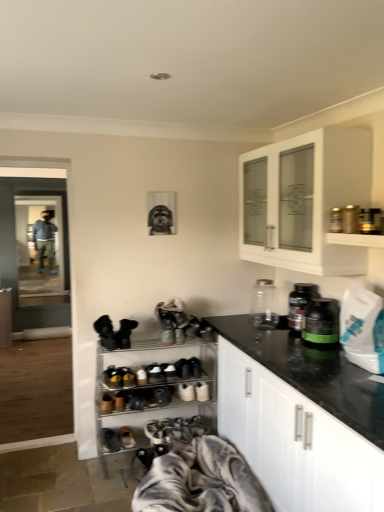
Question: Can you confirm if white glossy cabinet at upper right, which is the second cabinetry in right-to-left order, is bigger than brown suede shoe at lower center, positioned as the 3th footwear in top-to-bottom order?

Choices:
 (A) yes
 (B) no

Answer: (A)

Question: From the image's perspective, is white glossy cabinet at upper right, the first cabinetry in the top-to-bottom sequence, beneath brown suede shoe at lower center, positioned as the 3th footwear in top-to-bottom order?

Choices:
 (A) no
 (B) yes

Answer: (A)

Question: Considering the relative sizes of white glossy cabinet at upper right, which ranks as the second cabinetry in back-to-front order, and brown suede shoe at lower center, positioned as the 3th footwear in top-to-bottom order, in the image provided, is white glossy cabinet at upper right, which ranks as the second cabinetry in back-to-front order, shorter than brown suede shoe at lower center, positioned as the 3th footwear in top-to-bottom order,?

Choices:
 (A) no
 (B) yes

Answer: (A)

Question: Is brown suede shoe at lower center, positioned as the 3th footwear in top-to-bottom order, surrounded by white glossy cabinet at upper right, which is the second cabinetry from front to back?

Choices:
 (A) no
 (B) yes

Answer: (A)

Question: Is white glossy cabinet at upper right, the second cabinetry viewed from the left, with brown suede shoe at lower center, positioned as the 3th footwear in top-to-bottom order?

Choices:
 (A) yes
 (B) no

Answer: (B)

Question: Is white suede sneakers at center, which is the 2th footwear in top-to-bottom order, taller or shorter than white matte cabinet at lower right, acting as the first cabinetry starting from the right?

Choices:
 (A) tall
 (B) short

Answer: (B)

Question: Considering the positions of white suede sneakers at center, which is the 2th footwear in top-to-bottom order, and white matte cabinet at lower right, acting as the first cabinetry starting from the right, in the image, is white suede sneakers at center, which is the 2th footwear in top-to-bottom order, wider or thinner than white matte cabinet at lower right, acting as the first cabinetry starting from the right,?

Choices:
 (A) thin
 (B) wide

Answer: (A)

Question: Is point [x=178, y=394] positioned closer to the camera than point [x=263, y=480]?

Choices:
 (A) closer
 (B) farther

Answer: (B)

Question: In the image, is white suede sneakers at center, the fourth footwear when ordered from bottom to top, on the left side or the right side of white matte cabinet at lower right, placed as the third cabinetry when sorted from back to front?

Choices:
 (A) right
 (B) left

Answer: (B)

Question: From the image's perspective, relative to white matte cabinet at lower right, placed as the 3th cabinetry when sorted from left to right, is black matte shoe at center, which is the 4th shoe from left to right, above or below?

Choices:
 (A) above
 (B) below

Answer: (A)

Question: Considering their positions, is black matte shoe at center, which is the 4th shoe from left to right, located in front of or behind white matte cabinet at lower right, placed as the 3th cabinetry when sorted from left to right?

Choices:
 (A) behind
 (B) front

Answer: (A)

Question: In terms of width, does black matte shoe at center, which is the 4th shoe from left to right, look wider or thinner when compared to white matte cabinet at lower right, acting as the first cabinetry starting from the right?

Choices:
 (A) wide
 (B) thin

Answer: (B)

Question: Based on their positions, is black matte shoe at center, placed as the first shoe when sorted from right to left, located to the left or right of white matte cabinet at lower right, which is the 1th cabinetry in bottom-to-top order?

Choices:
 (A) left
 (B) right

Answer: (A)

Question: Considering the positions of brown suede shoe at lower center, the 3th footwear in the bottom-to-top sequence, and transparent glass jar at right in the image, is brown suede shoe at lower center, the 3th footwear in the bottom-to-top sequence, taller or shorter than transparent glass jar at right?

Choices:
 (A) tall
 (B) short

Answer: (B)

Question: From the image's perspective, relative to transparent glass jar at right, is brown suede shoe at lower center, positioned as the 3th footwear in top-to-bottom order, above or below?

Choices:
 (A) above
 (B) below

Answer: (B)